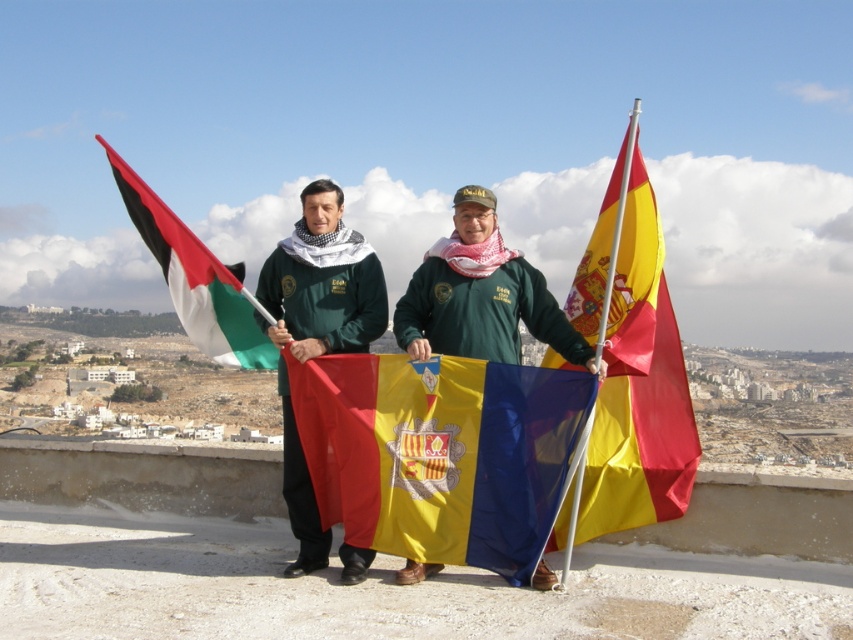
You are a photographer trying to capture a photo of the matte green sweatshirt at center and the black and white striped flag at left. Which object is shorter in height?

The matte green sweatshirt at center is shorter than the black and white striped flag at left.